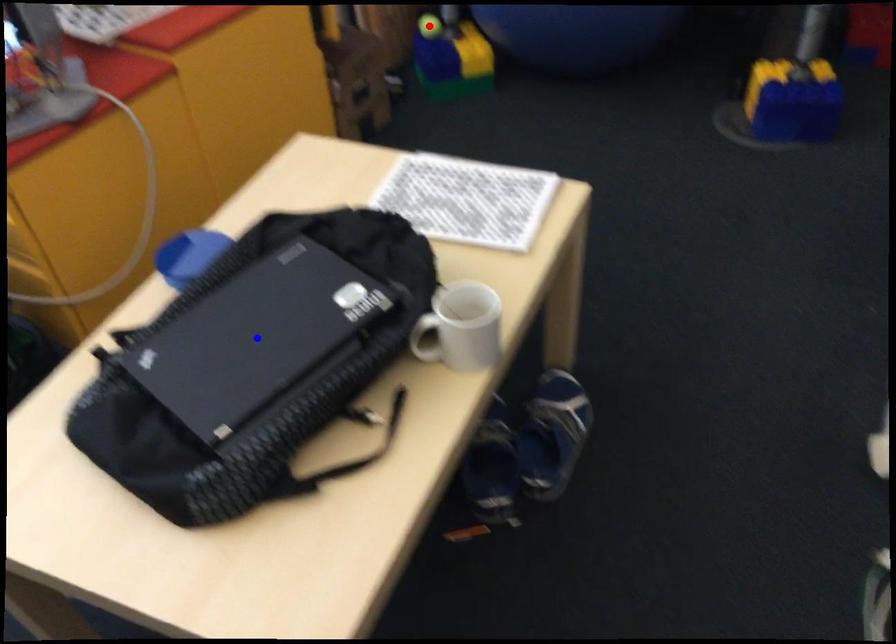
Question: Two points are marked on the image. Which point is closer to the camera?

Choices:
 (A) Blue point is closer.
 (B) Red point is closer.

Answer: (A)